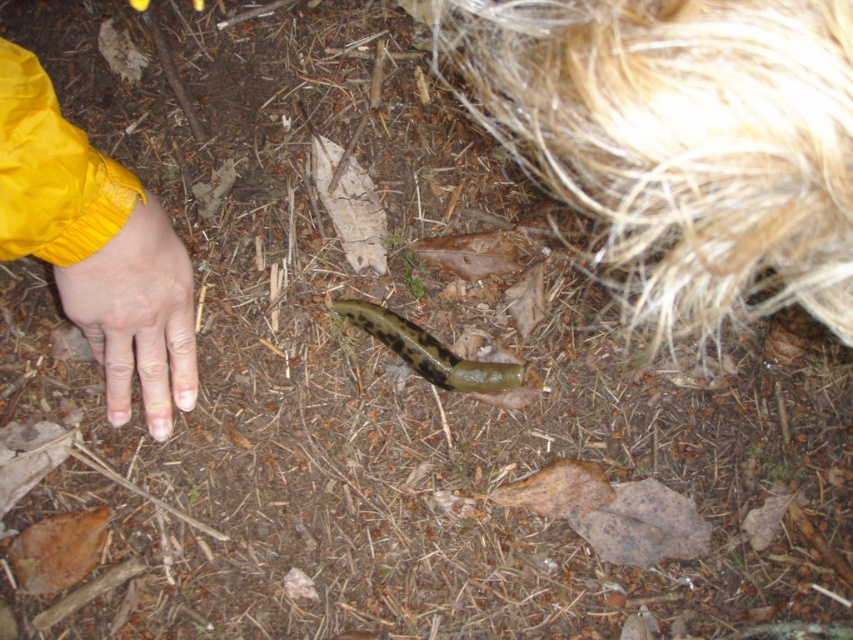
You are a nature photographer holding a camera. You see a yellow matte hand at lower left and a green slimy slug at center. Which object is located to the right of the other?

The green slimy slug at center is located to the right of the yellow matte hand at lower left.

Based on the photo, you are a photographer trying to capture the slug in the forest floor scene. You notice the yellow matte hand at lower left at point (137,316). Where should you position your camera to ensure the slug is in focus while avoiding the hand?

Position the camera so the slug is centered and the yellow matte hand at lower left is out of frame or shifted away from the slug. Since the hand is at point (137,316), adjusting the camera angle slightly to the right or upward would keep the slug in focus while avoiding the hand.

Looking at this image, you are a hiker who has just spotted two points on the forest floor. The first point is at coordinates point [178,307] and the second is at point [482,384]. Which point is closer to you as you stand observing the scene?

Point [178,307] is in front of point [482,384], so it is closer to you.